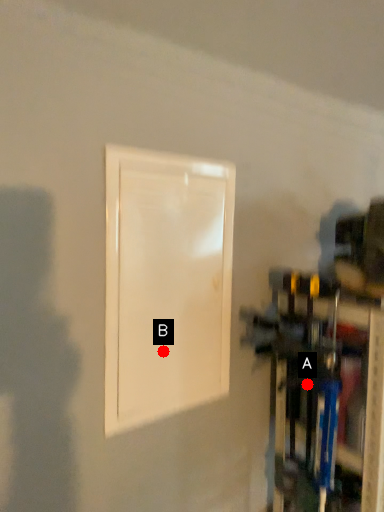
Question: Two points are circled on the image, labeled by A and B beside each circle. Which point is further to the camera?

Choices:
 (A) A is further
 (B) B is further

Answer: (A)